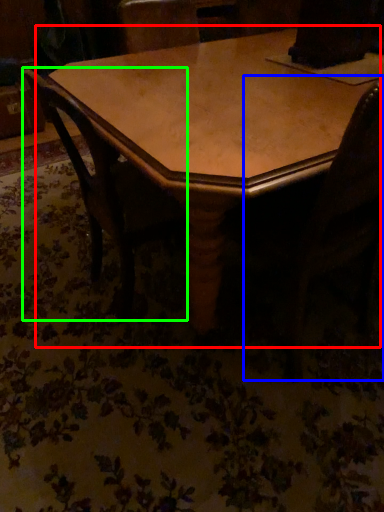
Question: Which is farther away from table (highlighted by a red box)? swivel chair (highlighted by a blue box) or chair (highlighted by a green box)?

Choices:
 (A) swivel chair
 (B) chair

Answer: (A)